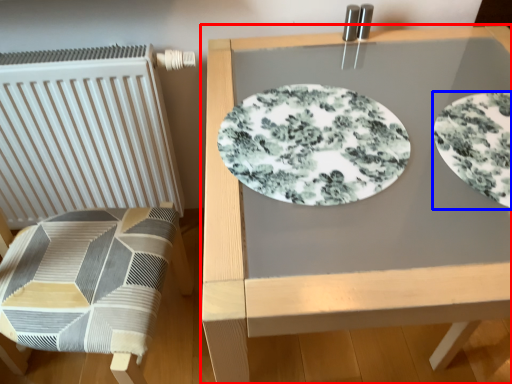
Question: Which of the following is the farthest to the observer, table (highlighted by a red box) or plate (highlighted by a blue box)?

Choices:
 (A) table
 (B) plate

Answer: (B)